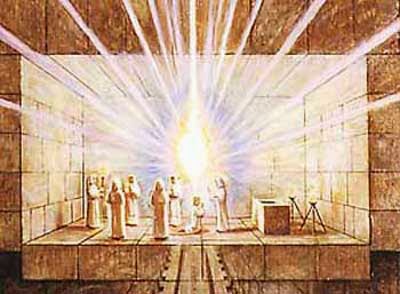
Image resolution: width=400 pixels, height=294 pixels. Identify the location of light. (198, 150).